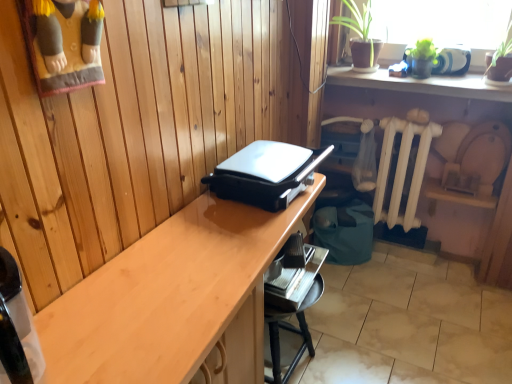
Question: Is black plastic waffle iron at center completely or partially inside white painted metal radiator at lower right?

Choices:
 (A) no
 (B) yes

Answer: (A)

Question: From the image's perspective, is white painted metal radiator at lower right located beneath black plastic waffle iron at center?

Choices:
 (A) no
 (B) yes

Answer: (B)

Question: Is white painted metal radiator at lower right smaller than black plastic waffle iron at center?

Choices:
 (A) yes
 (B) no

Answer: (B)

Question: Can you confirm if white painted metal radiator at lower right is shorter than black plastic waffle iron at center?

Choices:
 (A) yes
 (B) no

Answer: (B)

Question: Is white painted metal radiator at lower right wider than black plastic waffle iron at center?

Choices:
 (A) no
 (B) yes

Answer: (A)

Question: From a real-world perspective, is green matte shelf at upper right positioned above or below light wood desk at center?

Choices:
 (A) below
 (B) above

Answer: (B)

Question: Is green matte shelf at upper right taller or shorter than light wood desk at center?

Choices:
 (A) tall
 (B) short

Answer: (B)

Question: Would you say green matte shelf at upper right is inside or outside light wood desk at center?

Choices:
 (A) outside
 (B) inside

Answer: (A)

Question: Is green matte shelf at upper right in front of or behind light wood desk at center in the image?

Choices:
 (A) behind
 (B) front

Answer: (A)

Question: Relative to light wood desk at center, is white painted metal radiator at lower right in front or behind?

Choices:
 (A) front
 (B) behind

Answer: (B)

Question: From the image's perspective, is white painted metal radiator at lower right above or below light wood desk at center?

Choices:
 (A) below
 (B) above

Answer: (B)

Question: Is white painted metal radiator at lower right inside the boundaries of light wood desk at center, or outside?

Choices:
 (A) inside
 (B) outside

Answer: (B)

Question: Is white painted metal radiator at lower right taller or shorter than light wood desk at center?

Choices:
 (A) tall
 (B) short

Answer: (B)

Question: Based on their sizes in the image, would you say black plastic waffle iron at center is bigger or smaller than white painted metal radiator at lower right?

Choices:
 (A) big
 (B) small

Answer: (B)

Question: From their relative heights in the image, would you say black plastic waffle iron at center is taller or shorter than white painted metal radiator at lower right?

Choices:
 (A) tall
 (B) short

Answer: (B)